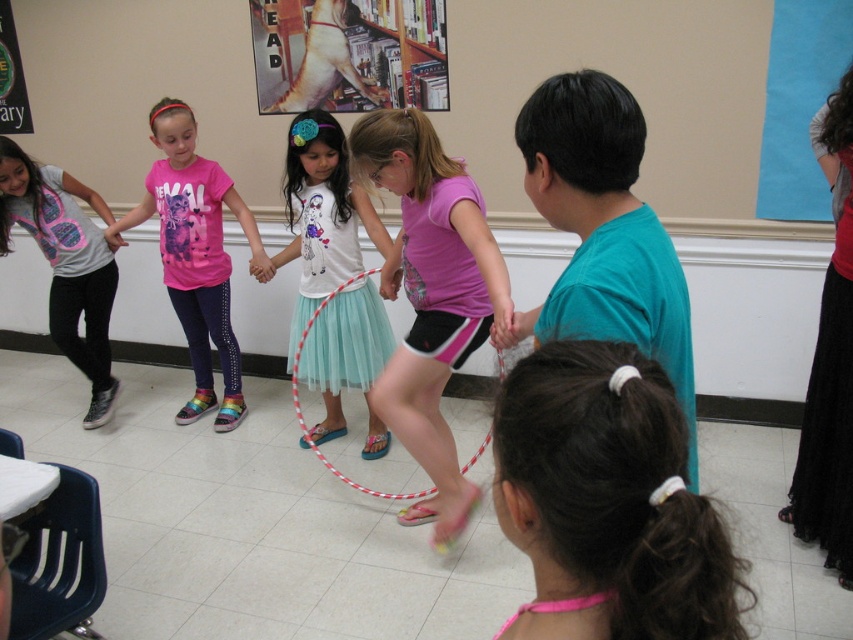
Can you confirm if pink matte shorts at center is positioned to the left of matte pink hula hoop at center?

Yes, pink matte shorts at center is to the left of matte pink hula hoop at center.

This screenshot has height=640, width=853. Describe the element at coordinates (431, 296) in the screenshot. I see `pink matte shorts at center` at that location.

This screenshot has width=853, height=640. Describe the element at coordinates (431, 296) in the screenshot. I see `pink matte shorts at center` at that location.

The width and height of the screenshot is (853, 640). I want to click on pink matte shorts at center, so click(431, 296).

Which of these two, teal smooth shirt at upper right or matte pink shirt at left, stands shorter?

teal smooth shirt at upper right

Who is more distant from viewer, (610, 310) or (65, 324)?

The point (65, 324) is behind.

Between point (604, 141) and point (62, 224), which one is positioned in front?

Point (604, 141) is more forward.

Identify the location of teal smooth shirt at upper right. The width and height of the screenshot is (853, 640). tap(605, 228).

Which is more to the left, teal tulle skirt at center or matte pink shirt at left?

Positioned to the left is matte pink shirt at left.

Is point (277, 257) closer to camera compared to point (94, 388)?

Yes, point (277, 257) is closer to viewer.

I want to click on teal tulle skirt at center, so click(322, 212).